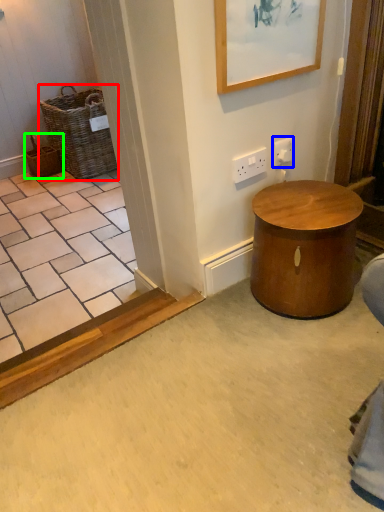
Question: Which object is the closest to the basket (highlighted by a red box)? Choose among these: electric outlet (highlighted by a blue box) or basket (highlighted by a green box).

Choices:
 (A) electric outlet
 (B) basket

Answer: (B)